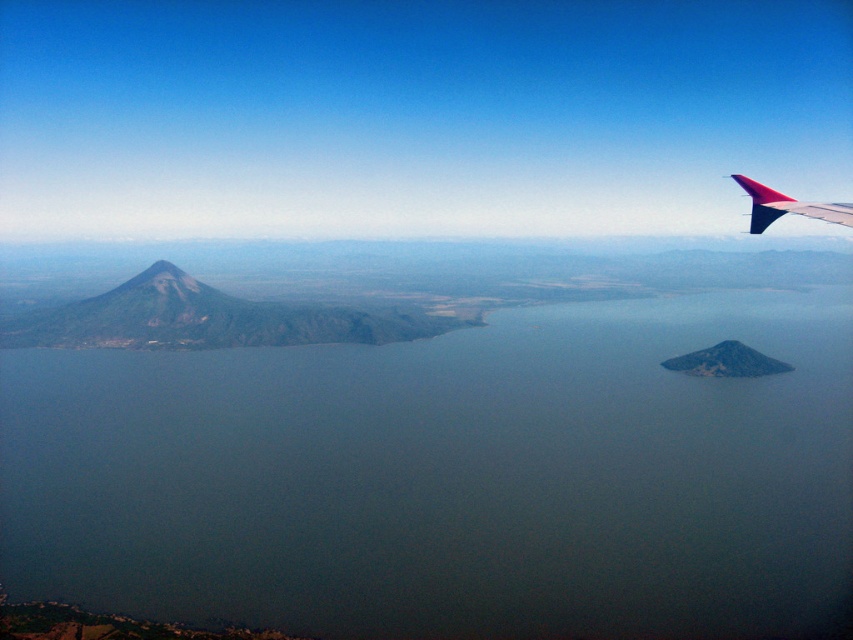
You are a pilot flying a small aircraft and notice the green matte water at center and the polished aluminum winglet at upper right in your view. Which object appears closer to your aircraft based on their relative heights?

The green matte water at center appears closer to the aircraft because it has a lesser height compared to the polished aluminum winglet at upper right, making the winglet seem farther away.

You are a pilot flying a small aircraft and need to land on the green matte water at center. The polished aluminum winglet at upper right is part of your plane. Can you safely land without the winglet hitting the water?

The green matte water at center might be wider than polished aluminum winglet at upper right, so there is a possibility that the winglet could hit the water during landing. To ensure safety, the pilot should adjust the landing approach to keep the winglet clear of the water surface.